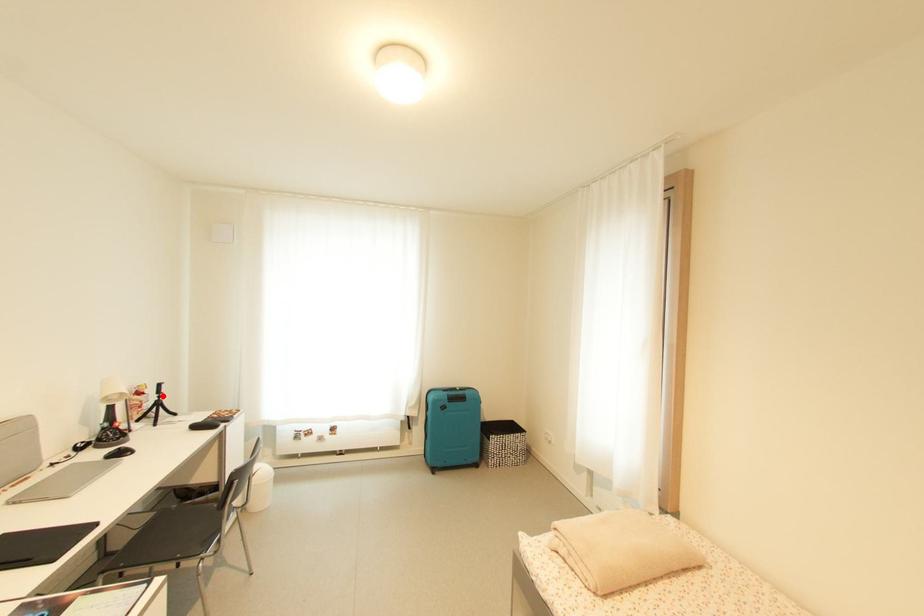
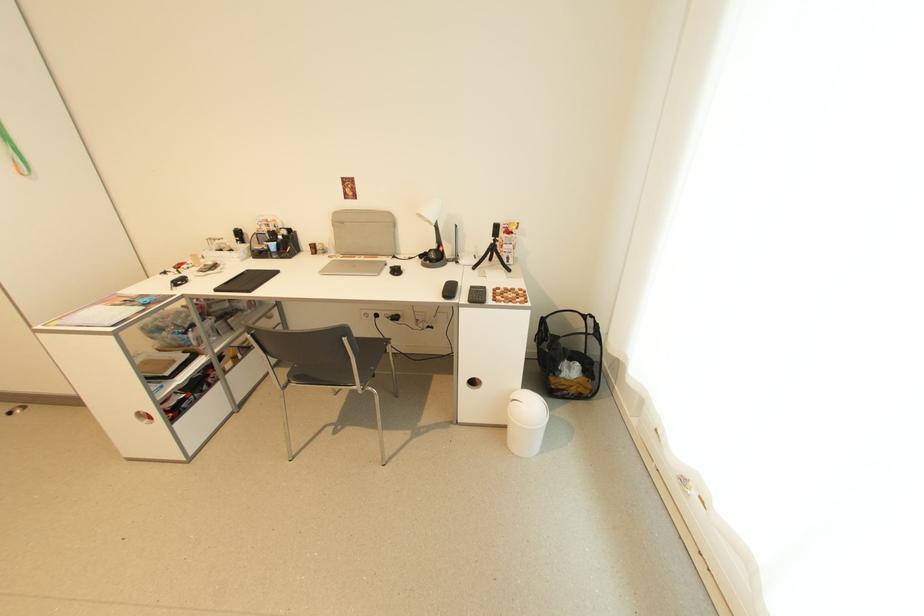
The point at the highlighted location is marked in the first image. Where is the corresponding point in the second image?

(497, 238)